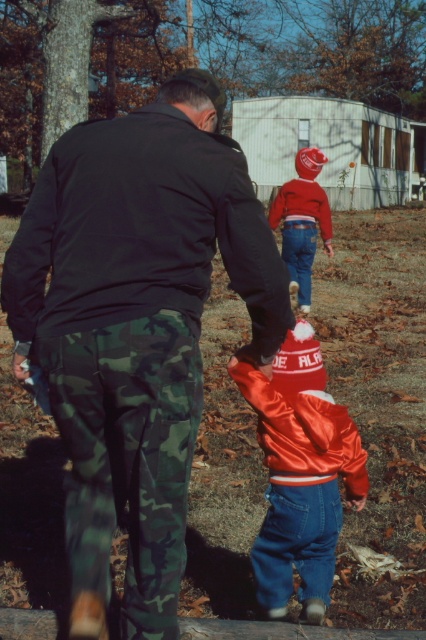
Question: Among these points, which one is farthest from the camera?

Choices:
 (A) (132, 125)
 (B) (290, 182)

Answer: (B)

Question: Is camouflage pants at center thinner than shiny red jacket at center?

Choices:
 (A) yes
 (B) no

Answer: (B)

Question: Which point is farther to the camera?

Choices:
 (A) (354, 436)
 (B) (304, 204)

Answer: (B)

Question: From the image, what is the correct spatial relationship of camouflage pants at center in relation to shiny red jacket at center?

Choices:
 (A) below
 (B) above

Answer: (A)

Question: Is satin red jacket at lower center to the right of shiny orange jacket at lower right from the viewer's perspective?

Choices:
 (A) no
 (B) yes

Answer: (A)

Question: Which of the following is the farthest from the observer?

Choices:
 (A) shiny red jacket at center
 (B) shiny orange jacket at lower right

Answer: (A)